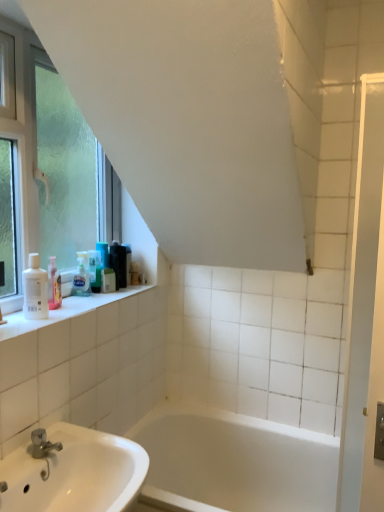
Question: Is black plastic container at upper left, the 6th toiletry positioned from the front, wider than frosted glass window at left?

Choices:
 (A) no
 (B) yes

Answer: (A)

Question: Is black plastic container at upper left, the first toiletry positioned from the back, aimed at frosted glass window at left?

Choices:
 (A) no
 (B) yes

Answer: (A)

Question: Does black plastic container at upper left, the 6th toiletry positioned from the front, have a greater height compared to frosted glass window at left?

Choices:
 (A) yes
 (B) no

Answer: (B)

Question: From a real-world perspective, is black plastic container at upper left, the first toiletry positioned from the back, on top of frosted glass window at left?

Choices:
 (A) no
 (B) yes

Answer: (A)

Question: Is black plastic container at upper left, the first toiletry positioned from the back, positioned beyond the bounds of frosted glass window at left?

Choices:
 (A) no
 (B) yes

Answer: (B)

Question: From the image's perspective, is frosted glass window at left positioned above or below black plastic container at upper left, the 6th toiletry positioned from the front?

Choices:
 (A) above
 (B) below

Answer: (A)

Question: Is point (26, 199) positioned closer to the camera than point (130, 281)?

Choices:
 (A) farther
 (B) closer

Answer: (B)

Question: From a real-world perspective, is frosted glass window at left positioned above or below black plastic container at upper left, the first toiletry positioned from the back?

Choices:
 (A) below
 (B) above

Answer: (B)

Question: Is frosted glass window at left in front of or behind black plastic container at upper left, the first toiletry positioned from the back, in the image?

Choices:
 (A) front
 (B) behind

Answer: (A)

Question: From the image's perspective, relative to translucent plastic bottle at upper left, which ranks as the 4th toiletry in front-to-back order, is frosted glass window at left above or below?

Choices:
 (A) below
 (B) above

Answer: (B)

Question: From their relative heights in the image, would you say frosted glass window at left is taller or shorter than translucent plastic bottle at upper left, which is the third toiletry from back to front?

Choices:
 (A) short
 (B) tall

Answer: (B)

Question: Considering the positions of frosted glass window at left and translucent plastic bottle at upper left, which is the third toiletry from back to front, in the image, is frosted glass window at left wider or thinner than translucent plastic bottle at upper left, which is the third toiletry from back to front,?

Choices:
 (A) thin
 (B) wide

Answer: (B)

Question: Considering the positions of frosted glass window at left and translucent plastic bottle at upper left, which ranks as the 4th toiletry in front-to-back order, in the image, is frosted glass window at left bigger or smaller than translucent plastic bottle at upper left, which ranks as the 4th toiletry in front-to-back order,?

Choices:
 (A) small
 (B) big

Answer: (B)

Question: From the image's perspective, is black plastic container at upper left, the first toiletry positioned from the back, located above or below translucent plastic bottles at upper left, the second toiletry viewed from the back?

Choices:
 (A) below
 (B) above

Answer: (A)

Question: From a real-world perspective, is black plastic container at upper left, the first toiletry positioned from the back, positioned above or below translucent plastic bottles at upper left, the fifth toiletry when ordered from front to back?

Choices:
 (A) below
 (B) above

Answer: (A)